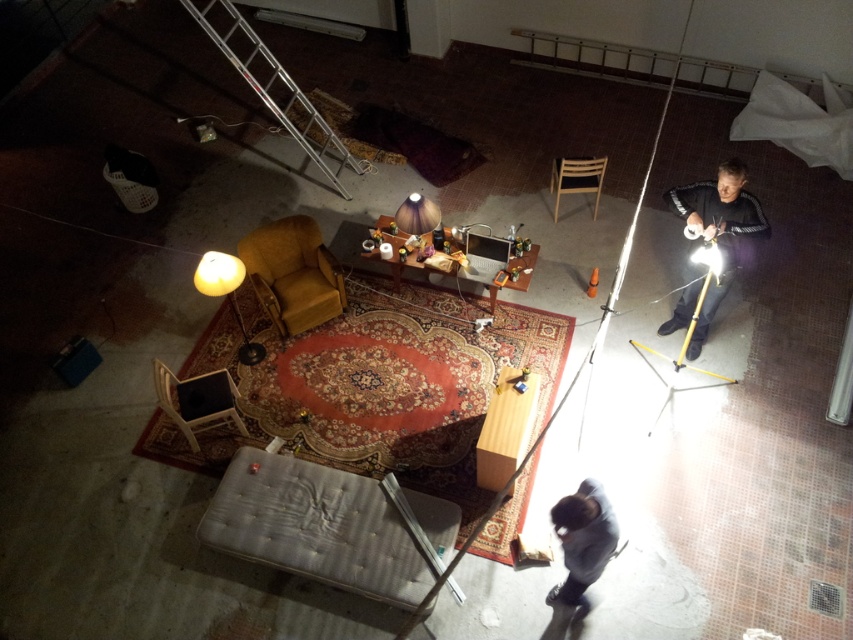
You are a delivery robot that needs to deliver a package to the black matte jacket at right. You are currently positioned at the light gray fabric ottoman at center. The package requires a delivery distance of less than 11 feet. Can you successfully deliver the package within the required distance?

The light gray fabric ottoman at center is 10.57 feet away from the black matte jacket at right. Since 10.57 feet is less than 11 feet, the delivery robot can successfully deliver the package within the required distance.

You are a delivery robot with a package that needs to be placed on the wooden box at center. You are currently positioned near the black matte jacket at right. Given that your maximum carrying distance is 2 meters, can you safely deliver the package without needing to recharge?

The distance between the black matte jacket at right and the wooden box at center is 1.93 meters, which is within your 2 meter carrying range. Therefore, you can safely deliver the package without needing to recharge.